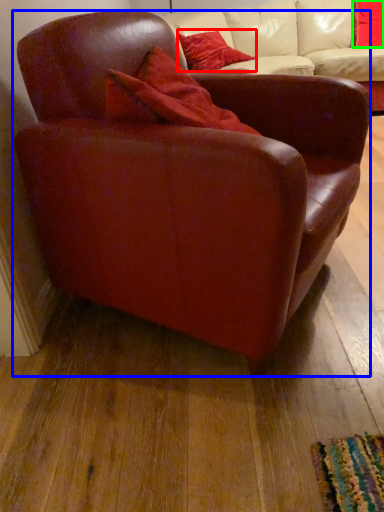
Question: Which object is positioned closest to pillow (highlighted by a red box)? Select from chair (highlighted by a blue box) and pillow (highlighted by a green box).

Choices:
 (A) chair
 (B) pillow

Answer: (B)